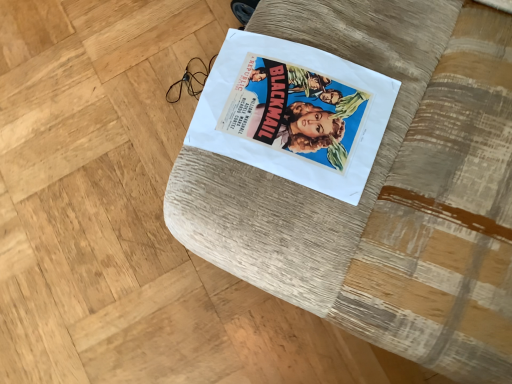
Identify the location of textured fabric cushion at center. (385, 191).

What is the approximate height of textured fabric cushion at center?

textured fabric cushion at center is 35.12 inches in height.

This screenshot has height=384, width=512. What do you see at coordinates (385, 191) in the screenshot?
I see `textured fabric cushion at center` at bounding box center [385, 191].

Locate an element on the screen. The width and height of the screenshot is (512, 384). white paper at center is located at coordinates (294, 113).

Describe the element at coordinates (294, 113) in the screenshot. This screenshot has height=384, width=512. I see `white paper at center` at that location.

In order to click on textured fabric cushion at center in this screenshot , I will do `click(385, 191)`.

Which is more to the left, white paper at center or textured fabric cushion at center?

white paper at center.

Considering the positions of objects white paper at center and textured fabric cushion at center in the image provided, who is behind, white paper at center or textured fabric cushion at center?

white paper at center is behind.

Does point (223, 95) come closer to viewer compared to point (344, 320)?

That is False.

From the image's perspective, is white paper at center positioned above or below textured fabric cushion at center?

From the image's perspective, white paper at center appears above textured fabric cushion at center.

From a real-world perspective, is white paper at center located higher than textured fabric cushion at center?

Actually, white paper at center is physically below textured fabric cushion at center in the real world.

Is white paper at center thinner than textured fabric cushion at center?

Yes, white paper at center is thinner than textured fabric cushion at center.

Considering the sizes of white paper at center and textured fabric cushion at center in the image, is white paper at center taller or shorter than textured fabric cushion at center?

Clearly, white paper at center is shorter compared to textured fabric cushion at center.

Consider the image. Who is smaller, white paper at center or textured fabric cushion at center?

Smaller between the two is white paper at center.

Is white paper at center inside the boundaries of textured fabric cushion at center, or outside?

white paper at center can be found inside textured fabric cushion at center.

Is white paper at center in contact with textured fabric cushion at center?

Yes, the surface of white paper at center is in contact with textured fabric cushion at center.

Is white paper at center facing away from textured fabric cushion at center?

Correct, white paper at center is looking away from textured fabric cushion at center.

What's the angular difference between white paper at center and textured fabric cushion at center's facing directions?

The facing directions of white paper at center and textured fabric cushion at center are 4.23 degrees apart.

Locate an element on the screen. furniture that appears in front of the white paper at center is located at coordinates (385, 191).

Is textured fabric cushion at center to the left of white paper at center from the viewer's perspective?

Incorrect, textured fabric cushion at center is not on the left side of white paper at center.

Who is more distant, textured fabric cushion at center or white paper at center?

white paper at center is behind.

Is point (457, 4) positioned behind point (375, 123)?

Yes, point (457, 4) is farther from viewer.

From the image's perspective, is textured fabric cushion at center on top of white paper at center?

No, from the image's perspective, textured fabric cushion at center is not on top of white paper at center.

From a real-world perspective, is textured fabric cushion at center positioned above or below white paper at center?

From a real-world perspective, textured fabric cushion at center is physically above white paper at center.

Which of these two, textured fabric cushion at center or white paper at center, is thinner?

Thinner between the two is white paper at center.

Between textured fabric cushion at center and white paper at center, which one has more height?

textured fabric cushion at center.

Can you confirm if textured fabric cushion at center is smaller than white paper at center?

Actually, textured fabric cushion at center might be larger than white paper at center.

Would you say textured fabric cushion at center is inside or outside white paper at center?

textured fabric cushion at center is not inside white paper at center, it's outside.

Is the surface of textured fabric cushion at center in direct contact with white paper at center?

Yes, textured fabric cushion at center and white paper at center clearly make contact.

Is textured fabric cushion at center facing towards white paper at center?

Yes.

Looking at this image, can you tell me how much textured fabric cushion at center and white paper at center differ in facing direction?

There is a 4.23-degree angle between the facing directions of textured fabric cushion at center and white paper at center.

Where is `furniture in front of the white paper at center`? furniture in front of the white paper at center is located at coordinates click(x=385, y=191).

Where is `paperback book beneath the textured fabric cushion at center (from a real-world perspective)`? The width and height of the screenshot is (512, 384). paperback book beneath the textured fabric cushion at center (from a real-world perspective) is located at coordinates (294, 113).

Locate an element on the screen. This screenshot has width=512, height=384. paperback book that appears above the textured fabric cushion at center (from the image's perspective) is located at coordinates (294, 113).